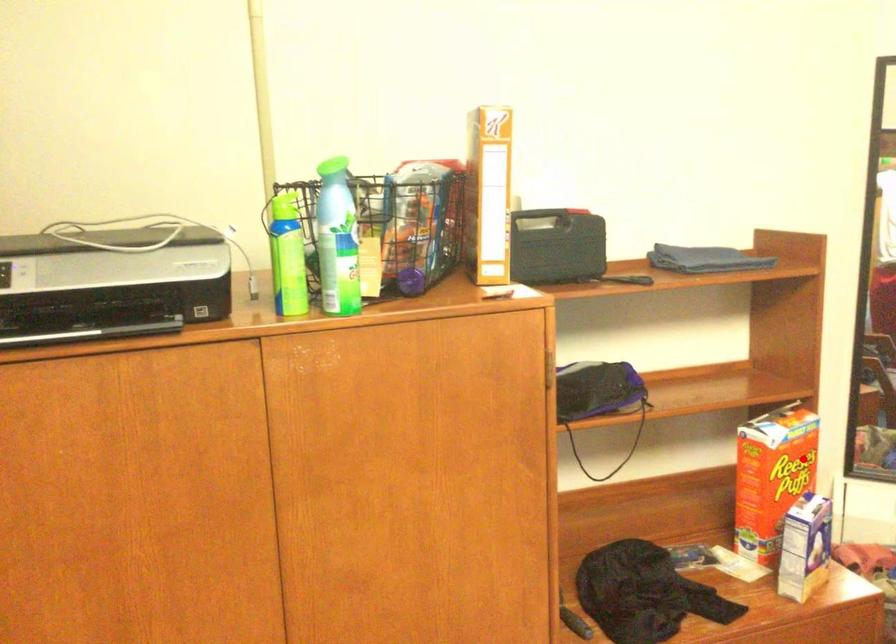
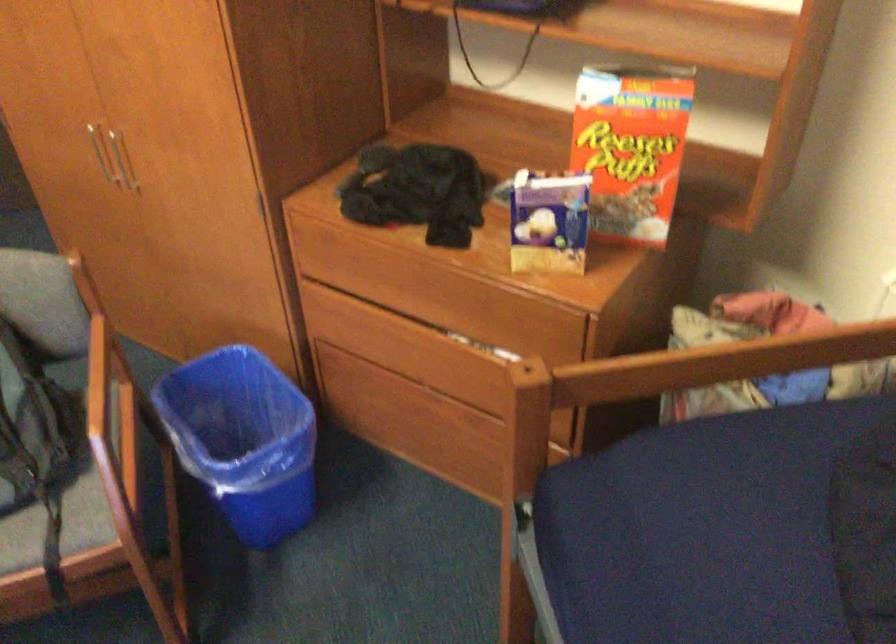
Find the pixel in the second image that matches the highlighted location in the first image.

(631, 146)